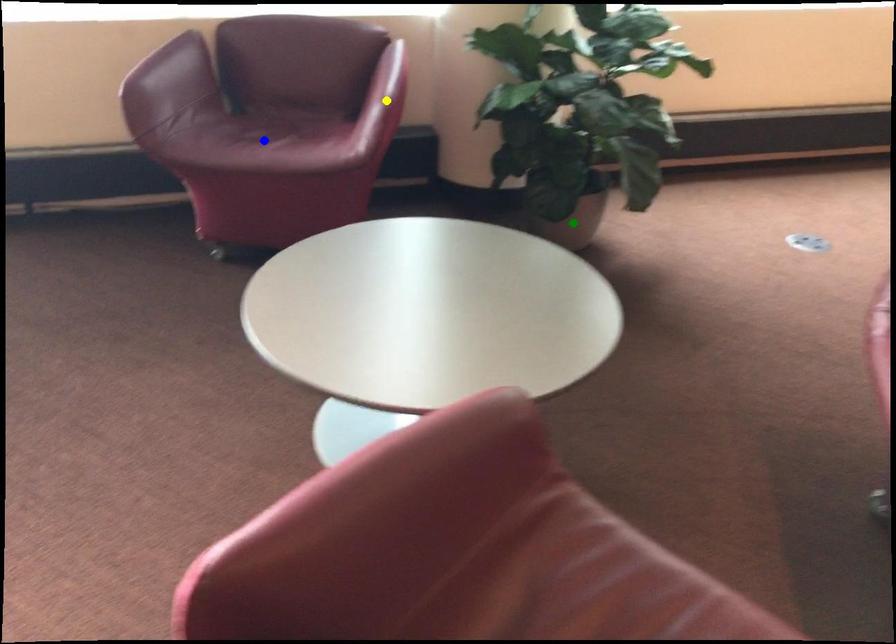
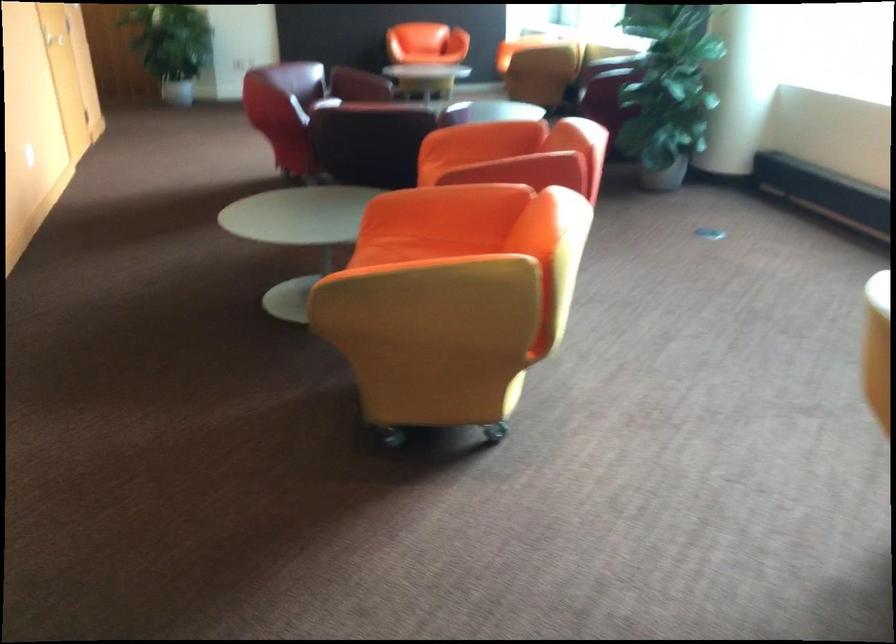
I am providing you with two images of the same scene from different viewpoints. Three points are marked in image1. Which point corresponds to a part or object that is occluded in image2?In image1, three points are marked. Which of them correspond to a part or object that is occluded in image2?Among the three points shown in image1, which one corresponds to a part or object that is no longer visible due to occlusion in image2?

blue point, yellow point cannot be seen in image2.